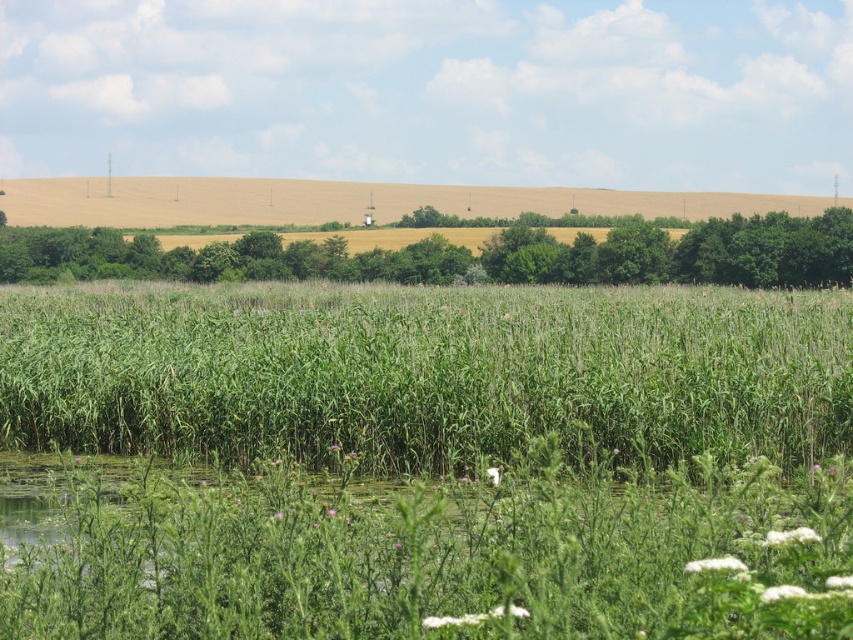
You are a farmer planning to plant a new crop in the field. You notice the green grassy at center and the green leafy tree at center. Which area would you choose for planting crops that require more space, and why?

The green grassy at center is bigger than the green leafy tree at center, so you should choose the green grassy at center for planting crops that require more space because it provides a larger area.

You are standing in the rural landscape and want to take a photo of both the green grassy at center and the green leafy tree at center. Which object should you focus on first to ensure both are in the frame?

You should focus on the green leafy tree at center first because the green grassy at center is in front of it, so adjusting the camera to include the tree will naturally include the grassy area as well.